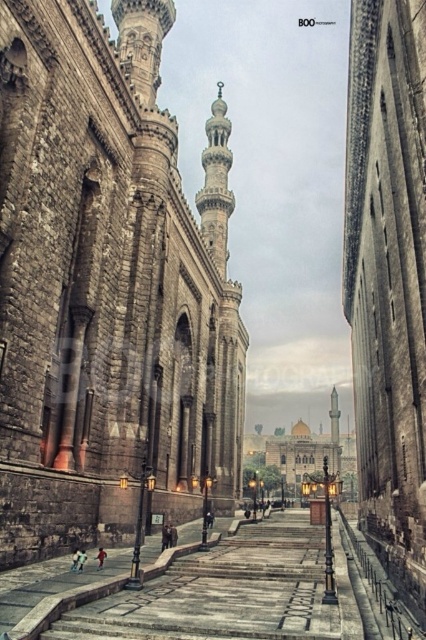
Between point (383, 246) and point (210, 236), which one is positioned in front?

Point (383, 246) is more forward.

The height and width of the screenshot is (640, 426). What are the coordinates of `dark brown stone tower at center` in the screenshot? It's located at (x=388, y=282).

Between dark brown stone tower at center and polished stone minaret at upper center, which one is positioned higher?

polished stone minaret at upper center

This screenshot has height=640, width=426. Identify the location of dark brown stone tower at center. point(388,282).

The image size is (426, 640). What are the coordinates of `dark brown stone tower at center` in the screenshot? It's located at (388, 282).

I want to click on dark brown stone tower at center, so click(388, 282).

Does stone minaret at center appear over dark brown stone tower at center?

Yes, stone minaret at center is above dark brown stone tower at center.

Who is positioned more to the left, stone minaret at center or dark brown stone tower at center?

stone minaret at center

Does point (163, 234) come closer to viewer compared to point (371, 500)?

That is True.

This screenshot has height=640, width=426. Find the location of `stone minaret at center`. stone minaret at center is located at coordinates (109, 288).